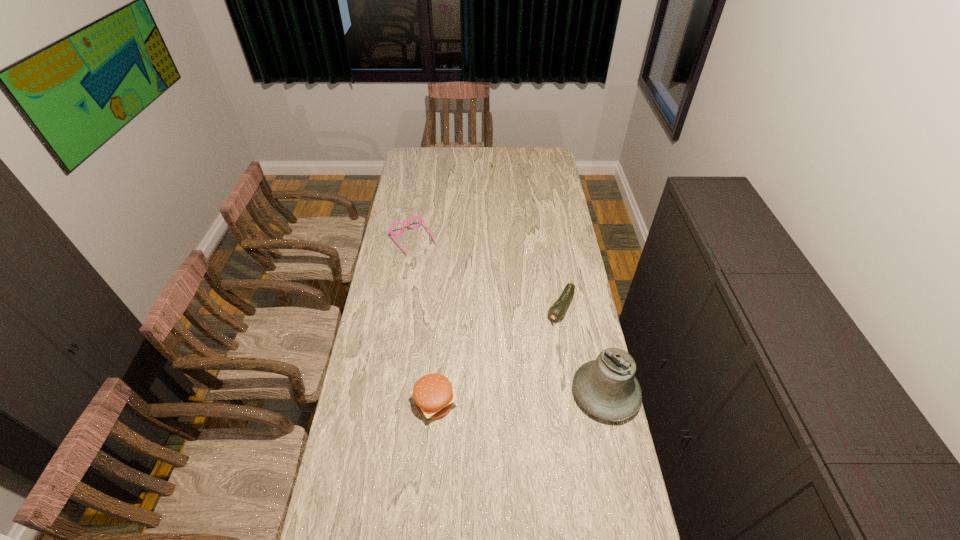
Find the location of `vacant area at the far right corner of the desktop`. vacant area at the far right corner of the desktop is located at coordinates (535, 168).

The image size is (960, 540). In order to click on vacant region at the near right corner of the desktop in this screenshot , I will do `click(605, 501)`.

What are the coordinates of `vacant point located between the zucchini and the second tallest object` in the screenshot? It's located at point(497,355).

Find the location of a particular element. free area in between the second tallest object and the farthest object is located at coordinates (423, 322).

Image resolution: width=960 pixels, height=540 pixels. In order to click on vacant space that is in between the bell and the third shortest object in this screenshot , I will do `click(519, 398)`.

Identify the location of vacant space in between the farthest object and the bell. (509, 317).

I want to click on vacant area between the tallest object and the third shortest object, so point(519,398).

Where is `blank region between the farthest object and the third shortest object`? The width and height of the screenshot is (960, 540). blank region between the farthest object and the third shortest object is located at coordinates (423, 322).

Where is `free space that is in between the farthest object and the third nearest object`? This screenshot has height=540, width=960. free space that is in between the farthest object and the third nearest object is located at coordinates (487, 274).

What are the coordinates of `blank region between the bell and the zucchini` in the screenshot? It's located at (583, 350).